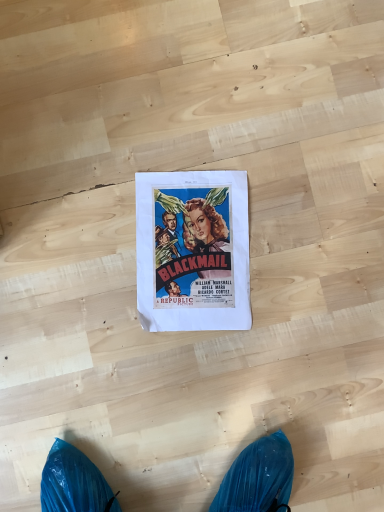
This screenshot has width=384, height=512. I want to click on vacant area on the back side of matte paper poster at center, so click(191, 123).